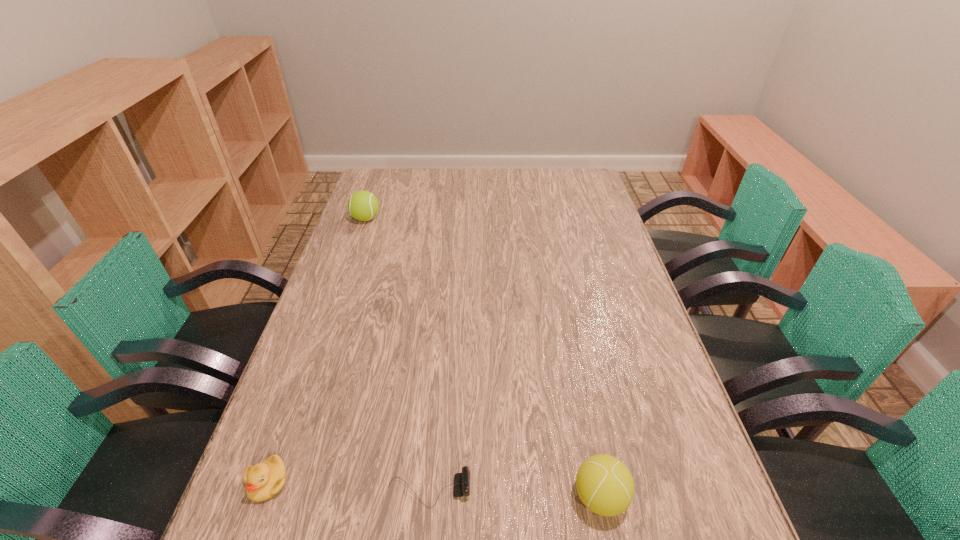
The image size is (960, 540). In order to click on the left tennis ball in this screenshot , I will do `click(363, 205)`.

The height and width of the screenshot is (540, 960). Identify the location of the farther tennis ball. (363, 205).

Find the location of a particular element. the nearer tennis ball is located at coordinates (605, 485).

The height and width of the screenshot is (540, 960). I want to click on the rightmost object, so click(605, 485).

You are a GUI agent. You are given a task and a screenshot of the screen. Output one action in this format:
    pyautogui.click(x=<x>, y=<y>)
    Task: Click on the duckling
    This screenshot has width=960, height=540.
    Given the screenshot: What is the action you would take?
    pyautogui.click(x=263, y=481)

Locate an element on the screen. The width and height of the screenshot is (960, 540). the third object from left to right is located at coordinates (461, 480).

This screenshot has height=540, width=960. In order to click on webcam in this screenshot , I will do `click(461, 480)`.

Find the location of a particular element. This screenshot has height=540, width=960. free space located 0.330m on the right of the farther tennis ball is located at coordinates (472, 219).

You are a GUI agent. You are given a task and a screenshot of the screen. Output one action in this format:
    pyautogui.click(x=<x>, y=<y>)
    Task: Click on the free region located on the back of the rightmost object
    The width and height of the screenshot is (960, 540).
    Given the screenshot: What is the action you would take?
    pyautogui.click(x=568, y=336)

Locate an element on the screen. Image resolution: width=960 pixels, height=540 pixels. free location located on the front-facing side of the webcam is located at coordinates (588, 490).